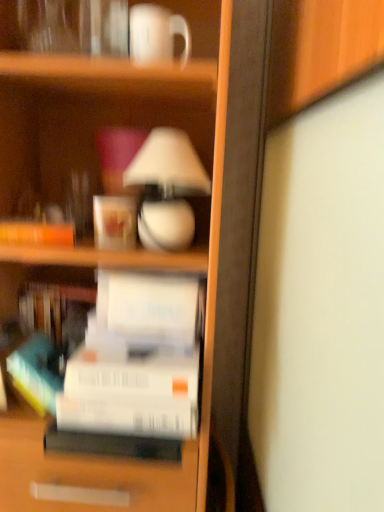
Question: Is white matte paper at center, the 2th paperback book in the bottom-to-top sequence, outside matte white coffee cup at upper center, the 2th coffee cup when ordered from top to bottom?

Choices:
 (A) no
 (B) yes

Answer: (B)

Question: Is white matte paper at center, which appears as the first paperback book when viewed from the top, smaller than matte white coffee cup at upper center, arranged as the 2th coffee cup when viewed from the right?

Choices:
 (A) no
 (B) yes

Answer: (A)

Question: Does white matte paper at center, which appears as the first paperback book when viewed from the top, appear on the right side of matte white coffee cup at upper center, the 2th coffee cup when ordered from top to bottom?

Choices:
 (A) no
 (B) yes

Answer: (B)

Question: From the image's perspective, is white matte paper at center, which appears as the first paperback book when viewed from the top, under matte white coffee cup at upper center, marked as the 1th coffee cup in a back-to-front arrangement?

Choices:
 (A) yes
 (B) no

Answer: (A)

Question: Is white matte paper at center, which appears as the first paperback book when viewed from the top, looking in the opposite direction of matte white coffee cup at upper center, the 2th coffee cup in the front-to-back sequence?

Choices:
 (A) no
 (B) yes

Answer: (A)

Question: In the image, is white matte paperback book at center, which appears as the 2th paperback book when viewed from the top, positioned in front of or behind matte white coffee cup at upper center, the 2th coffee cup in the front-to-back sequence?

Choices:
 (A) behind
 (B) front

Answer: (B)

Question: Is white matte paperback book at center, which appears as the 2th paperback book when viewed from the top, to the left or to the right of matte white coffee cup at upper center, the 2th coffee cup in the front-to-back sequence, in the image?

Choices:
 (A) left
 (B) right

Answer: (B)

Question: From their relative heights in the image, would you say white matte paperback book at center, which appears as the 2th paperback book when viewed from the top, is taller or shorter than matte white coffee cup at upper center, arranged as the 2th coffee cup when viewed from the right?

Choices:
 (A) tall
 (B) short

Answer: (A)

Question: From a real-world perspective, is white matte paperback book at center, the first paperback book in the bottom-to-top sequence, above or below matte white coffee cup at upper center, the 2th coffee cup in the front-to-back sequence?

Choices:
 (A) above
 (B) below

Answer: (B)

Question: Is white matte paperback book at center, which appears as the 2th paperback book when viewed from the top, bigger or smaller than white matte paper at center, which appears as the first paperback book when viewed from the top?

Choices:
 (A) big
 (B) small

Answer: (A)

Question: In terms of height, does white matte paperback book at center, which appears as the 2th paperback book when viewed from the top, look taller or shorter compared to white matte paper at center, the 2th paperback book in the bottom-to-top sequence?

Choices:
 (A) tall
 (B) short

Answer: (A)

Question: Is white matte paperback book at center, which appears as the 2th paperback book when viewed from the top, situated inside white matte paper at center, which appears as the first paperback book when viewed from the top, or outside?

Choices:
 (A) inside
 (B) outside

Answer: (B)

Question: Is point (150, 407) closer or farther from the camera than point (162, 283)?

Choices:
 (A) closer
 (B) farther

Answer: (A)

Question: Based on their positions, is white glossy mug at upper center, the first coffee cup viewed from the front, located to the left or right of white matte paper at center, the 2th paperback book in the bottom-to-top sequence?

Choices:
 (A) right
 (B) left

Answer: (A)

Question: Relative to white matte paper at center, the 2th paperback book in the bottom-to-top sequence, is white glossy mug at upper center, the first coffee cup viewed from the front, in front or behind?

Choices:
 (A) behind
 (B) front

Answer: (B)